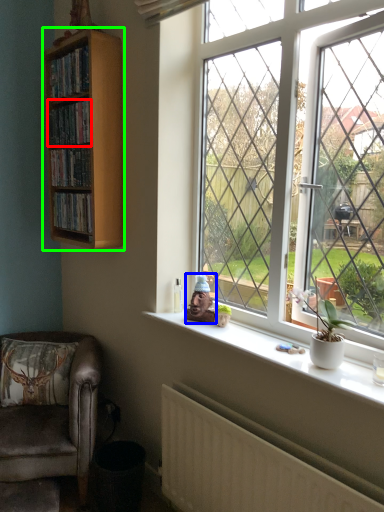
Question: Which object is positioned farthest from book (highlighted by a red box)? Select from toy (highlighted by a blue box) and bookcase (highlighted by a green box).

Choices:
 (A) toy
 (B) bookcase

Answer: (A)